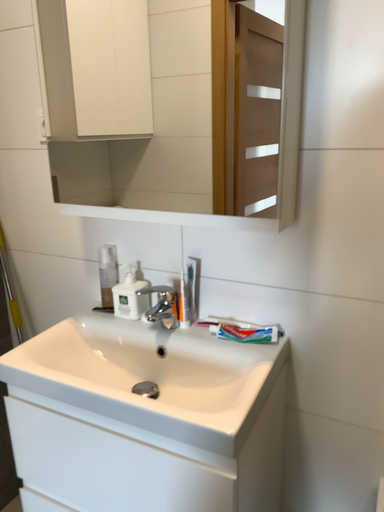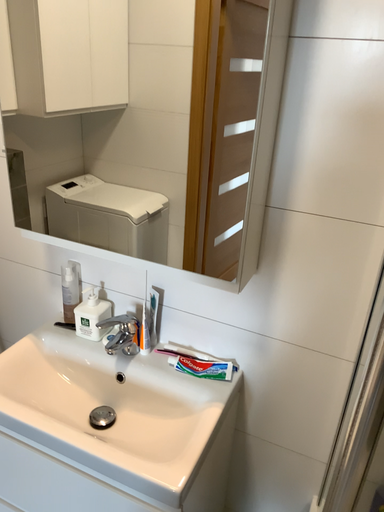
Question: How did the camera likely rotate when shooting the video?

Choices:
 (A) rotated downward
 (B) rotated upward

Answer: (A)